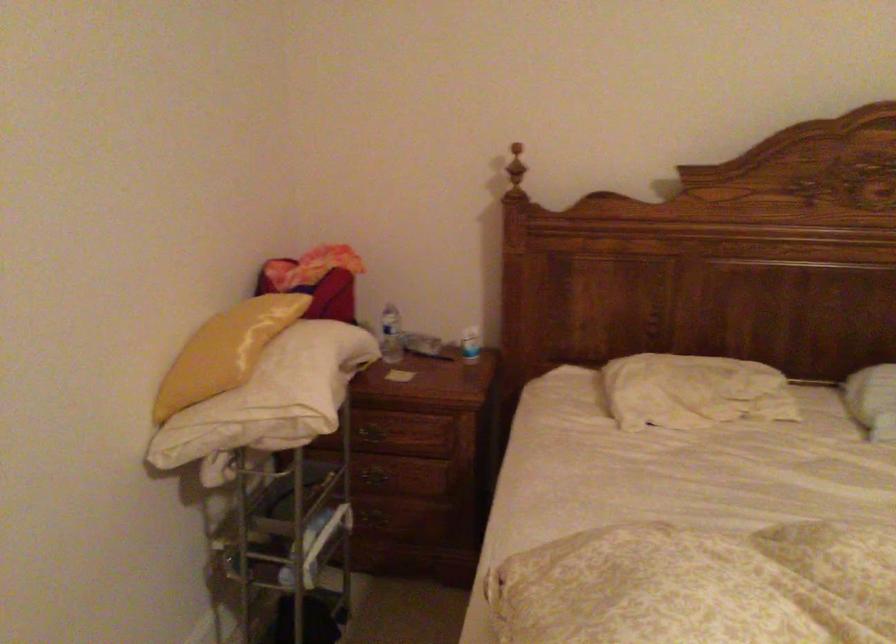
Image resolution: width=896 pixels, height=644 pixels. What are the coordinates of `yellow pillow` in the screenshot? It's located at (225, 351).